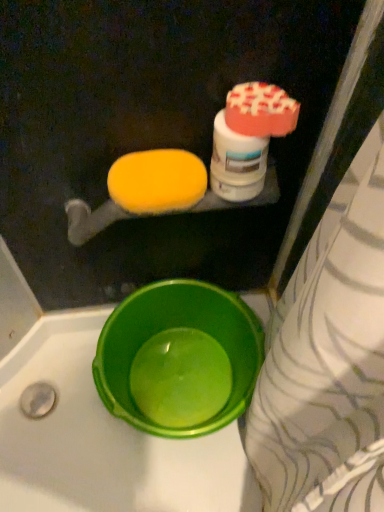
Identify the location of yellow sponge at upper left. This screenshot has height=512, width=384. (157, 181).

Considering the relative positions of green plastic basin at lower left and yellow sponge at upper left in the image provided, is green plastic basin at lower left to the left or to the right of yellow sponge at upper left?

In the image, green plastic basin at lower left appears on the right side of yellow sponge at upper left.

Is green plastic basin at lower left positioned with its back to yellow sponge at upper left?

That's not correct — green plastic basin at lower left is not looking away from yellow sponge at upper left.

Which of these two, green plastic basin at lower left or yellow sponge at upper left, is wider?

Wider between the two is green plastic basin at lower left.

Is white glossy bottle at upper right not within green plastic basin at lower left?

Yes, white glossy bottle at upper right is not within green plastic basin at lower left.

In the image, is white glossy bottle at upper right positioned in front of or behind green plastic basin at lower left?

Clearly, white glossy bottle at upper right is in front of green plastic basin at lower left.

Is white glossy bottle at upper right to the left or to the right of green plastic basin at lower left in the image?

Clearly, white glossy bottle at upper right is on the right of green plastic basin at lower left in the image.

From the picture: Is white glossy bottle at upper right inside green plastic basin at lower left?

That's incorrect, white glossy bottle at upper right is not inside green plastic basin at lower left.

Which object is more forward, green plastic basin at lower left or white glossy bottle at upper right?

white glossy bottle at upper right is closer to the camera.

Is green plastic basin at lower left shorter than white glossy bottle at upper right?

Incorrect, the height of green plastic basin at lower left does not fall short of that of white glossy bottle at upper right.

From the image's perspective, between green plastic basin at lower left and white glossy bottle at upper right, who is located below?

From the image's view, green plastic basin at lower left is below.

Considering the sizes of objects yellow sponge at upper left and green plastic basin at lower left in the image provided, who is thinner, yellow sponge at upper left or green plastic basin at lower left?

yellow sponge at upper left is thinner.

Find the location of a particular element. This screenshot has width=384, height=512. food located in front of the green plastic basin at lower left is located at coordinates (157, 181).

Is green plastic basin at lower left surrounded by yellow sponge at upper left?

Actually, green plastic basin at lower left is outside yellow sponge at upper left.

You are a GUI agent. You are given a task and a screenshot of the screen. Output one action in this format:
    pyautogui.click(x=<x>, y=<y>)
    Task: Click on the food on the left of white glossy bottle at upper right
    This screenshot has height=512, width=384.
    Given the screenshot: What is the action you would take?
    pyautogui.click(x=157, y=181)

From a real-world perspective, which is physically below, yellow sponge at upper left or white glossy bottle at upper right?

From a 3D spatial view, yellow sponge at upper left is below.

Between yellow sponge at upper left and white glossy bottle at upper right, which one has larger size?

Bigger between the two is white glossy bottle at upper right.

From the image's perspective, which is above, yellow sponge at upper left or white glossy bottle at upper right?

white glossy bottle at upper right.

How distant is white glossy bottle at upper right from yellow sponge at upper left?

3.78 inches.

In terms of size, does white glossy bottle at upper right appear bigger or smaller than yellow sponge at upper left?

In the image, white glossy bottle at upper right appears to be larger than yellow sponge at upper left.

Considering the positions of objects white glossy bottle at upper right and yellow sponge at upper left in the image provided, who is more to the left, white glossy bottle at upper right or yellow sponge at upper left?

From the viewer's perspective, yellow sponge at upper left appears more on the left side.

From a real-world perspective, is white glossy bottle at upper right beneath yellow sponge at upper left?

No, from a real-world perspective, white glossy bottle at upper right is not below yellow sponge at upper left.

Where is `basin below the yellow sponge at upper left (from a real-world perspective)`? basin below the yellow sponge at upper left (from a real-world perspective) is located at coordinates (177, 327).

Where is `cleaning product on the right side of green plastic basin at lower left`? The image size is (384, 512). cleaning product on the right side of green plastic basin at lower left is located at coordinates (248, 138).

Which object lies further to the anchor point green plastic basin at lower left, white glossy bottle at upper right or yellow sponge at upper left?

Based on the image, white glossy bottle at upper right appears to be further to green plastic basin at lower left.

Looking at the image, which one is located further to yellow sponge at upper left, green plastic basin at lower left or white glossy bottle at upper right?

green plastic basin at lower left.

Based on their spatial positions, is white glossy bottle at upper right or green plastic basin at lower left closer to yellow sponge at upper left?

white glossy bottle at upper right is closer to yellow sponge at upper left.

When comparing their distances from white glossy bottle at upper right, does green plastic basin at lower left or yellow sponge at upper left seem closer?

Among the two, yellow sponge at upper left is located nearer to white glossy bottle at upper right.

Based on their spatial positions, is yellow sponge at upper left or green plastic basin at lower left closer to white glossy bottle at upper right?

yellow sponge at upper left lies closer to white glossy bottle at upper right than the other object.

Which object lies nearer to the anchor point green plastic basin at lower left, yellow sponge at upper left or white glossy bottle at upper right?

yellow sponge at upper left.

The height and width of the screenshot is (512, 384). Find the location of `food between white glossy bottle at upper right and green plastic basin at lower left vertically`. food between white glossy bottle at upper right and green plastic basin at lower left vertically is located at coordinates (157, 181).